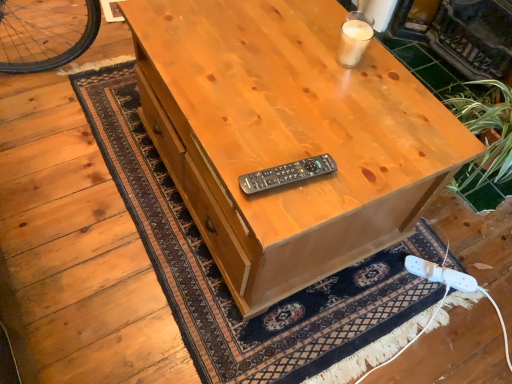
Question: Are white plastic game controller at lower right and natural wood desk at center making contact?

Choices:
 (A) no
 (B) yes

Answer: (A)

Question: From the image's perspective, is white plastic game controller at lower right on natural wood desk at center?

Choices:
 (A) no
 (B) yes

Answer: (A)

Question: Does white plastic game controller at lower right have a greater width compared to natural wood desk at center?

Choices:
 (A) no
 (B) yes

Answer: (A)

Question: Considering the relative sizes of white plastic game controller at lower right and natural wood desk at center in the image provided, is white plastic game controller at lower right smaller than natural wood desk at center?

Choices:
 (A) yes
 (B) no

Answer: (A)

Question: Considering the relative positions of white plastic game controller at lower right and natural wood desk at center in the image provided, is white plastic game controller at lower right to the left of natural wood desk at center from the viewer's perspective?

Choices:
 (A) yes
 (B) no

Answer: (B)

Question: Is white plastic game controller at lower right positioned far away from natural wood desk at center?

Choices:
 (A) no
 (B) yes

Answer: (A)

Question: Is white plastic game controller at lower right next to green tile fireplace at upper right and touching it?

Choices:
 (A) yes
 (B) no

Answer: (B)

Question: Is white plastic game controller at lower right thinner than green tile fireplace at upper right?

Choices:
 (A) no
 (B) yes

Answer: (B)

Question: From a real-world perspective, is white plastic game controller at lower right over green tile fireplace at upper right?

Choices:
 (A) no
 (B) yes

Answer: (A)

Question: Does white plastic game controller at lower right have a greater height compared to green tile fireplace at upper right?

Choices:
 (A) no
 (B) yes

Answer: (A)

Question: Is white plastic game controller at lower right turned away from green tile fireplace at upper right?

Choices:
 (A) yes
 (B) no

Answer: (B)

Question: Can you confirm if white plastic game controller at lower right is wider than green tile fireplace at upper right?

Choices:
 (A) no
 (B) yes

Answer: (A)

Question: Is white plastic game controller at lower right facing away from black plastic remote at center?

Choices:
 (A) yes
 (B) no

Answer: (B)